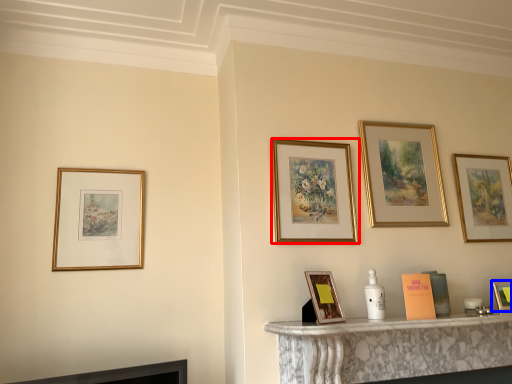
Question: Among these objects, which one is nearest to the camera, picture frame (highlighted by a red box) or picture frame (highlighted by a blue box)?

Choices:
 (A) picture frame
 (B) picture frame

Answer: (A)